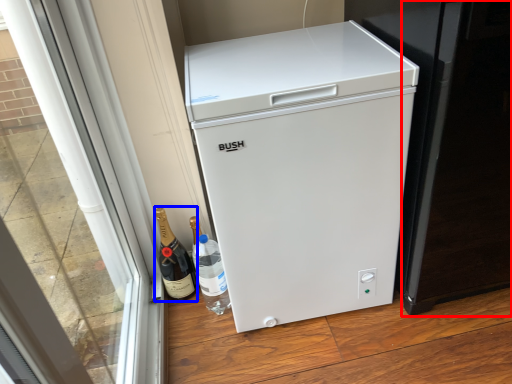
Question: Which object is further to the camera taking this photo, screen door (highlighted by a red box) or wine (highlighted by a blue box)?

Choices:
 (A) screen door
 (B) wine

Answer: (B)